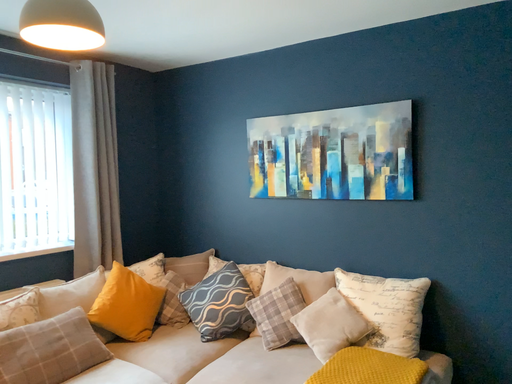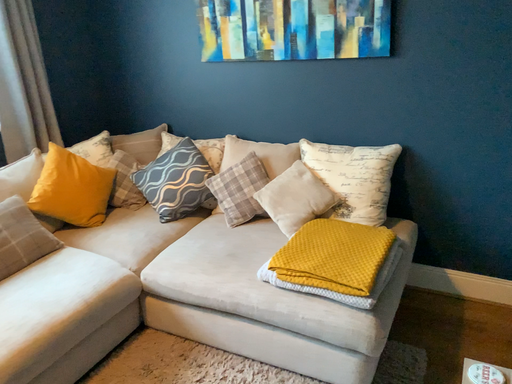
Question: Which way did the camera rotate in the video?

Choices:
 (A) rotated upward
 (B) rotated downward

Answer: (B)